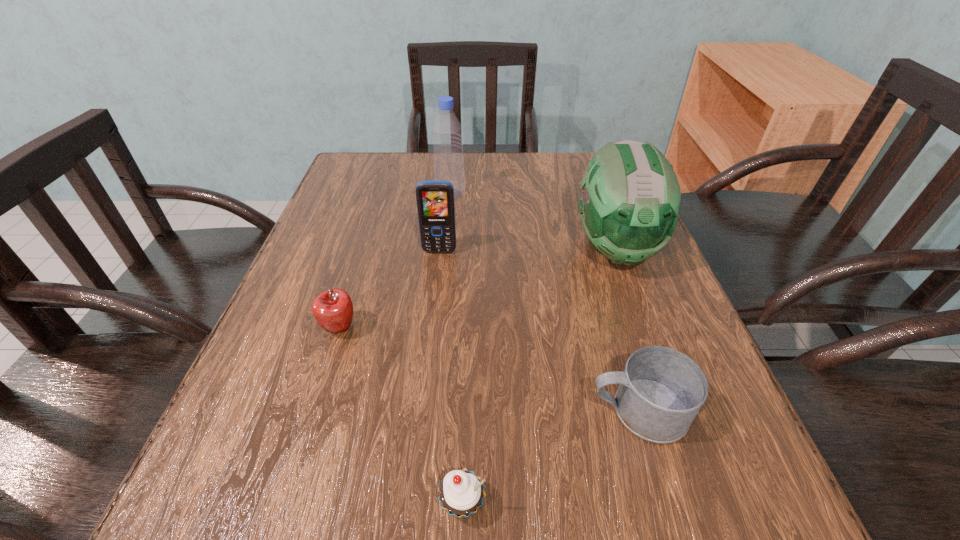
Identify the location of free space located on the left of the apple. This screenshot has height=540, width=960. point(282,328).

In order to click on free space located 0.070m on the side of the second nearest object with the handle in this screenshot , I will do `click(541, 410)`.

The image size is (960, 540). Identify the location of free space located on the side of the second nearest object with the handle. click(x=515, y=410).

Locate an element on the screen. vacant space located 0.100m on the side of the second nearest object with the handle is located at coordinates (521, 410).

This screenshot has width=960, height=540. Find the location of `free space located 0.270m on the left of the nearest object`. free space located 0.270m on the left of the nearest object is located at coordinates (225, 504).

This screenshot has width=960, height=540. Identify the location of object located in the far edge section of the desktop. (447, 132).

The width and height of the screenshot is (960, 540). Find the location of `object situated at the near edge`. object situated at the near edge is located at coordinates (461, 492).

Identify the location of object that is positioned at the left edge. The width and height of the screenshot is (960, 540). (333, 309).

At what (x,y) coordinates should I click in order to perform the action: click on football helmet situated at the right edge. Please return your answer as a coordinate pair (x, y). The width and height of the screenshot is (960, 540). Looking at the image, I should click on (630, 202).

Locate an element on the screen. This screenshot has height=540, width=960. mug that is positioned at the right edge is located at coordinates (661, 390).